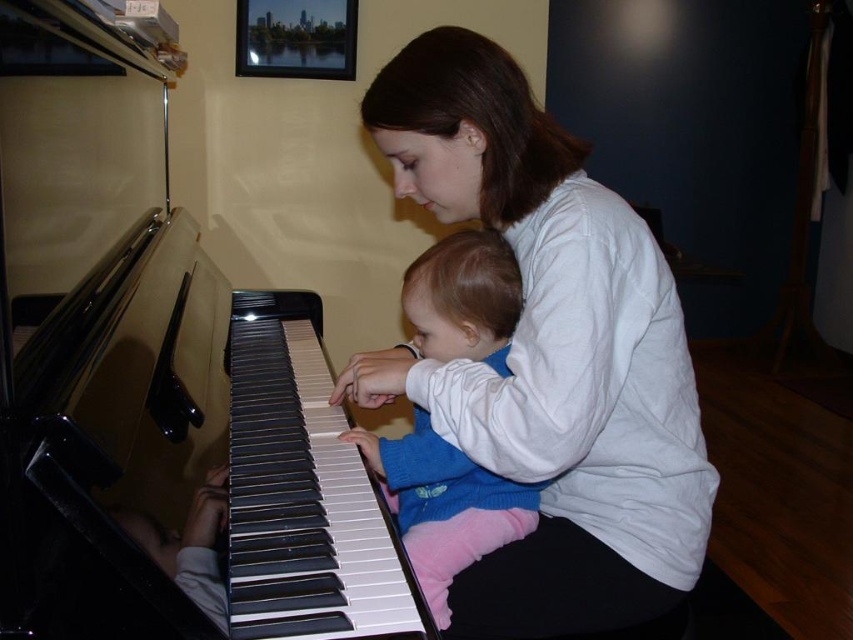
Is point (280, 540) positioned after point (456, 240)?

No, it is not.

Where is `black polished piano at left`? black polished piano at left is located at coordinates (196, 448).

Consider the image. Does white matte shirt at center appear over blue fleece sweater at center?

Yes, white matte shirt at center is above blue fleece sweater at center.

Does white matte shirt at center appear on the left side of blue fleece sweater at center?

Incorrect, white matte shirt at center is not on the left side of blue fleece sweater at center.

Is point (630, 387) closer to viewer compared to point (457, 486)?

Yes.

Locate an element on the screen. white matte shirt at center is located at coordinates (549, 353).

Who is shorter, white matte shirt at center or black polished piano at left?

black polished piano at left

Consider the image. Who is more forward, (556, 634) or (393, 627)?

Point (393, 627) is in front.

Find the location of a particular element. white matte shirt at center is located at coordinates (549, 353).